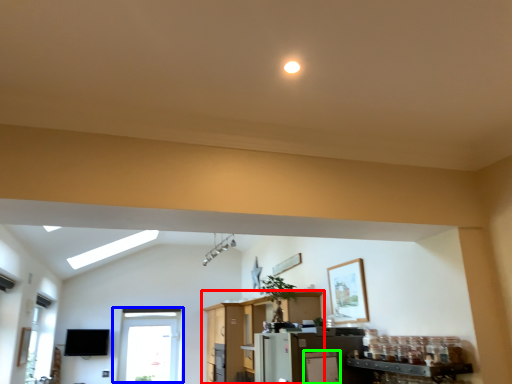
Question: Which is nearer to the entertainment center (highlighted by a red box)? window (highlighted by a blue box) or appliance (highlighted by a green box).

Choices:
 (A) window
 (B) appliance

Answer: (A)